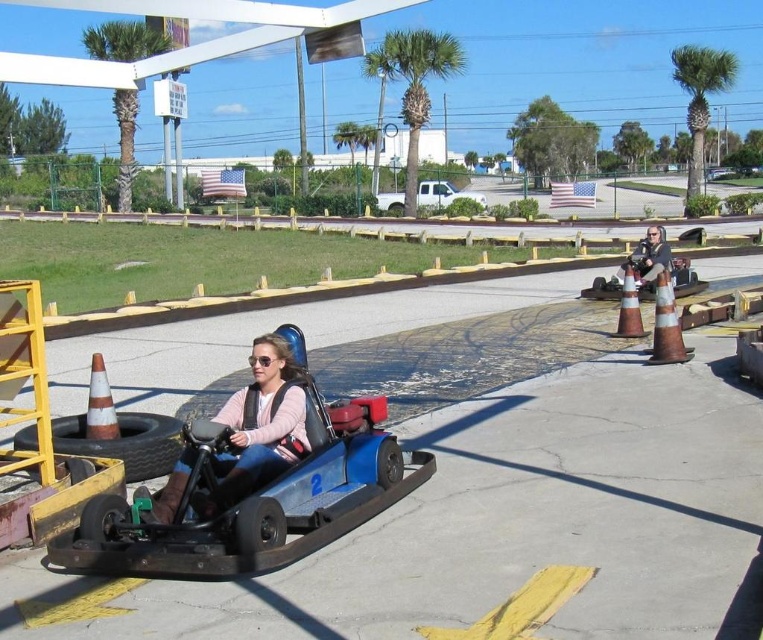
Is orange reflective cone at lower left in front of metallic silver car at center?

Yes, orange reflective cone at lower left is closer to the viewer.

Based on the photo, measure the distance between point (101, 426) and camera.

Point (101, 426) and camera are 7.02 meters apart.

Who is more forward, (92,392) or (710,179)?

Point (92,392) is more forward.

Where is `orange reflective cone at lower left`? orange reflective cone at lower left is located at coordinates (100, 403).

Can you confirm if blue plastic go-kart at center is positioned above orange reflective cone at lower left?

Yes, blue plastic go-kart at center is above orange reflective cone at lower left.

Does blue plastic go-kart at center have a lesser height compared to orange reflective cone at lower left?

In fact, blue plastic go-kart at center may be taller than orange reflective cone at lower left.

Does point (385, 588) come behind point (98, 410)?

No, it is not.

At what (x,y) coordinates should I click in order to perform the action: click on blue plastic go-kart at center. Please return your answer as a coordinate pair (x, y). Looking at the image, I should click on (504, 522).

Is matte blue go-kart at center wider than white textured cone at center-right?

Yes.

Is matte blue go-kart at center thinner than white textured cone at center-right?

Incorrect, matte blue go-kart at center's width is not less than white textured cone at center-right's.

Is point (269, 454) positioned after point (636, 333)?

No, (269, 454) is in front of (636, 333).

This screenshot has width=763, height=640. In order to click on matte blue go-kart at center in this screenshot , I will do click(259, 426).